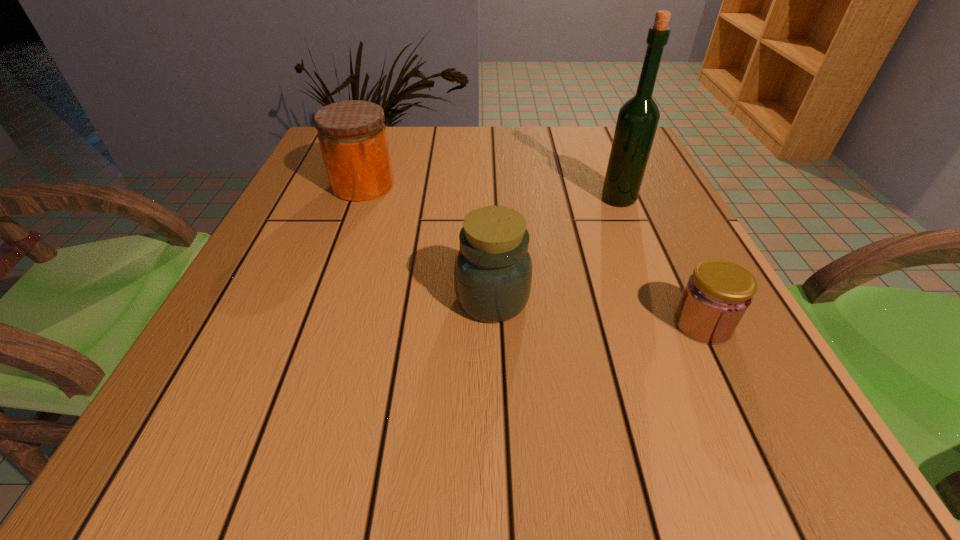
At what (x,y) coordinates should I click in order to perform the action: click on free space at the far right corner. Please return your answer as a coordinate pair (x, y). Image resolution: width=960 pixels, height=540 pixels. Looking at the image, I should click on (605, 163).

I want to click on vacant space at the near right corner of the desktop, so click(761, 460).

Locate an element on the screen. The width and height of the screenshot is (960, 540). vacant region between the leftmost object and the right jar is located at coordinates click(x=428, y=242).

Locate an element on the screen. This screenshot has width=960, height=540. unoccupied area between the jam and the tallest object is located at coordinates (660, 261).

Find the location of a particular element. The width and height of the screenshot is (960, 540). empty space that is in between the shortest object and the nearer jar is located at coordinates (598, 311).

Find the location of a particular element. free space between the nearer jar and the farther jar is located at coordinates (428, 242).

Image resolution: width=960 pixels, height=540 pixels. Identify the location of vacant area that lies between the shortest object and the third object from right to left. (598, 311).

Find the location of a particular element. free space that is in between the left jar and the liquor is located at coordinates (491, 192).

You are a GUI agent. You are given a task and a screenshot of the screen. Output one action in this format:
    pyautogui.click(x=<x>, y=<y>)
    Task: Click on the free space between the tallest object and the shortest object
    The image size is (960, 540).
    Given the screenshot: What is the action you would take?
    pyautogui.click(x=660, y=261)

Find the location of a particular element. unoccupied position between the liquor and the second object from left to right is located at coordinates (556, 249).